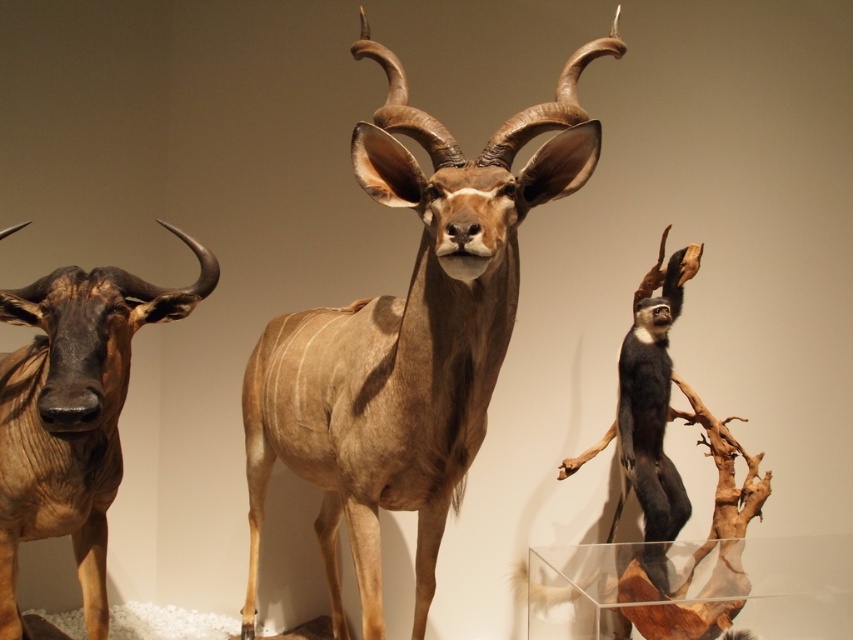
Please provide the exact 2D coordinates of the brown matte antelope at center in the image, as a point in the format of two decimal numbers separated by a comma. The coordinates should be precise to the hundredths place.

The exact 2D coordinates of the brown matte antelope at center are at point [408,337], which rounds to [409,339].

In the scene shown: You are a museum visitor standing in front of the taxidermied display. You want to take a photo of the brown matte antelope at center without getting too close. If your camera can focus on objects up to 2 meters away, will you be able to take a clear photo from where you are standing?

The distance between you and the brown matte antelope at center is 1.54 meters, which is within the camera focus range of 2 meters. Therefore, you can take a clear photo without moving closer.